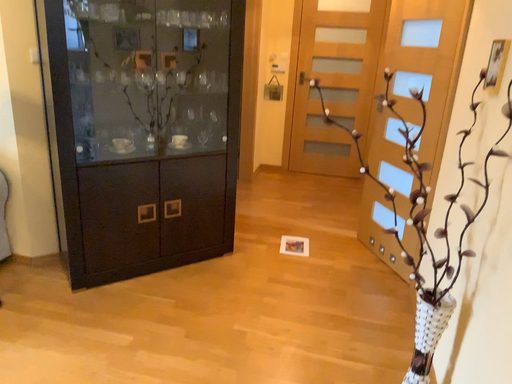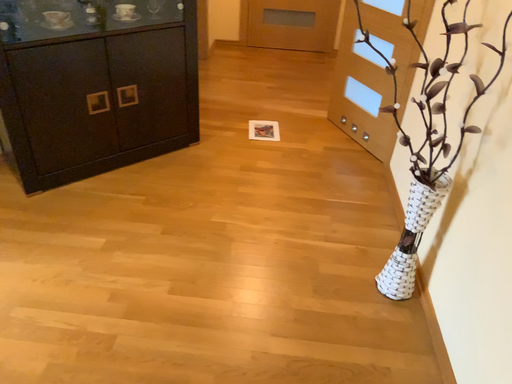
Question: How did the camera likely rotate when shooting the video?

Choices:
 (A) rotated right
 (B) rotated left

Answer: (A)